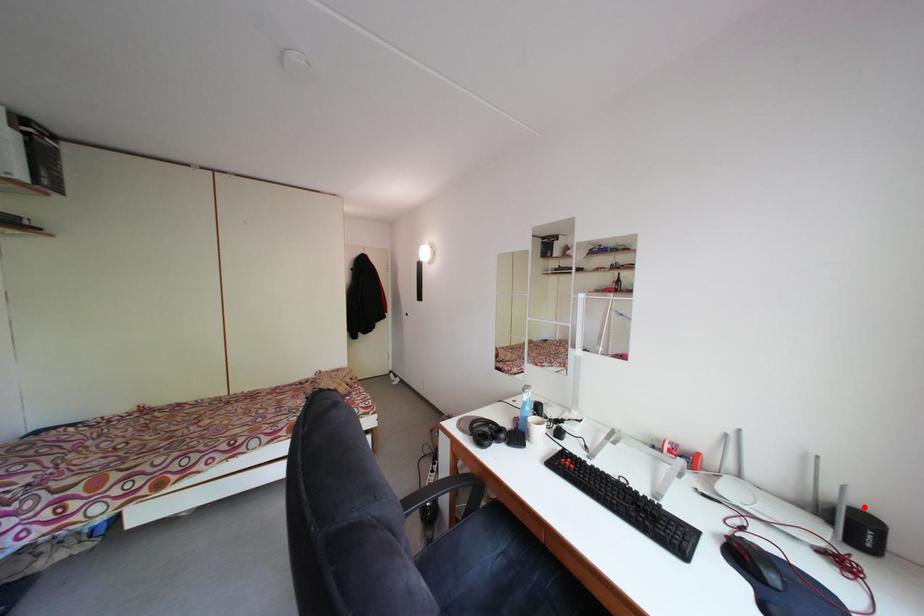
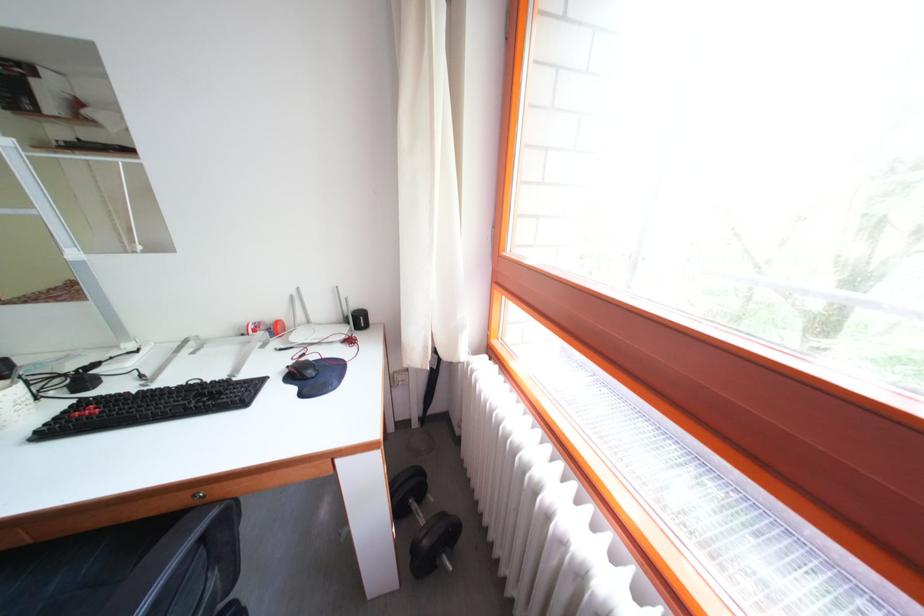
Where in the second image is the point corresponding to the highlighted location from the first image?

(365, 312)